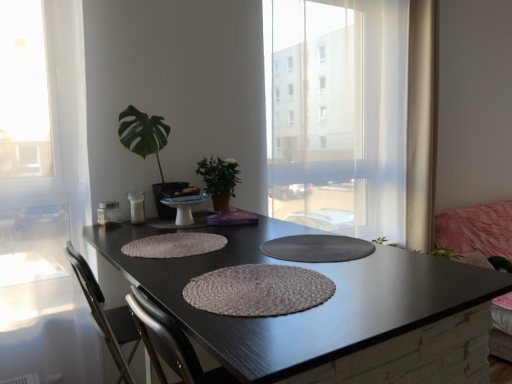
Question: Do you think white sheer curtain at right is within shiny black table at center, or outside of it?

Choices:
 (A) inside
 (B) outside

Answer: (B)

Question: In the image, is white sheer curtain at right positioned in front of or behind shiny black table at center?

Choices:
 (A) behind
 (B) front

Answer: (A)

Question: Estimate the real-world distances between objects in this image. Which object is closer to the pink fabric couch at right?

Choices:
 (A) shiny black table at center
 (B) white sheer curtain at right
 (C) green glossy leafy plant at upper left, the 2th houseplant positioned from the right
 (D) green matte plant at center, the second houseplant viewed from the left
 (E) rustic woven placemat at center, the 1th wide in the front-to-back sequence

Answer: (B)

Question: Which object is the farthest from the green glossy leafy plant at upper left, the first houseplant positioned from the left?

Choices:
 (A) shiny black table at center
 (B) rustic woven placemat at center, the 1th wide in the front-to-back sequence
 (C) pink fabric couch at right
 (D) white sheer curtain at right
 (E) rustic woven placemat at center, which is the second wide in front-to-back order

Answer: (C)